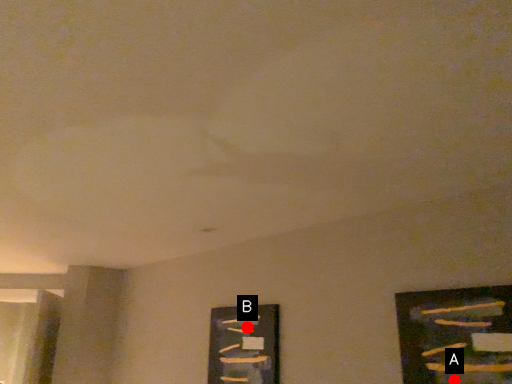
Question: Two points are circled on the image, labeled by A and B beside each circle. Which point appears closest to the camera in this image?

Choices:
 (A) A is closer
 (B) B is closer

Answer: (A)